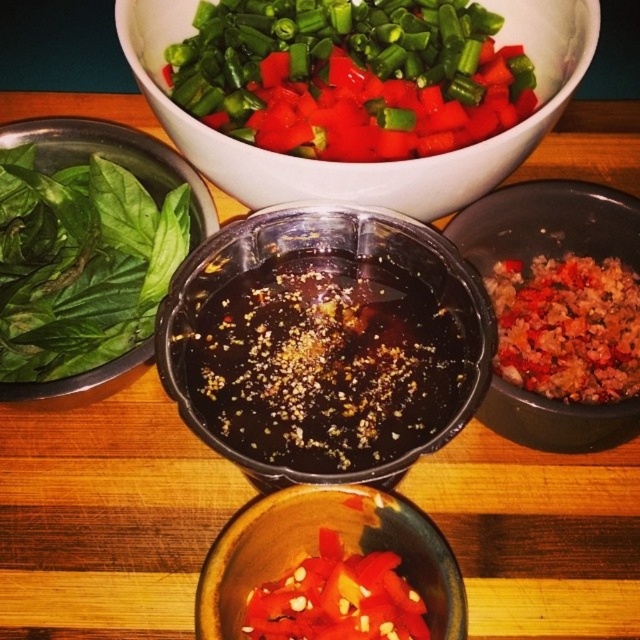
You are a chef preparing a dish and need to place a new ingredient bowl between the white ceramic bowl at upper center and the black bowl with dark liquid below it. Given the coordinates of the white ceramic bowl at upper center as point (369, 163), can you determine the direction to place the new bowl?

The white ceramic bowl at upper center is represented by point (369, 163). To place the new bowl between the white ceramic bowl at upper center and the black bowl with dark liquid below it, you should position it below the white ceramic bowl at upper center towards the black bowl with dark liquid.

You are a chef arranging ingredients on a wooden table. You have a matte ceramic bowl at lower center and brown crumbly rice at right. Which object has a greater width?

The matte ceramic bowl at lower center has a greater width than the brown crumbly rice at right according to the description.

You are a chef arranging bowls on a table for a cooking demonstration. You have a black plastic bowl at center and a matte ceramic bowl at lower center. If you want to place a new bowl between them, will there be enough space? The new bowl has a diameter of 3 inches.

The black plastic bowl at center and matte ceramic bowl at lower center are 4.64 inches apart. Since the new bowl has a diameter of 3 inches, there is sufficient space between them to place the new bowl.